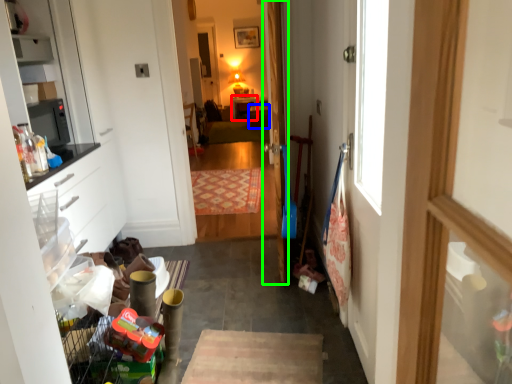
Question: Which object is the farthest from table (highlighted by a red box)? Choose among these: cabinetry (highlighted by a blue box) or door (highlighted by a green box).

Choices:
 (A) cabinetry
 (B) door

Answer: (B)